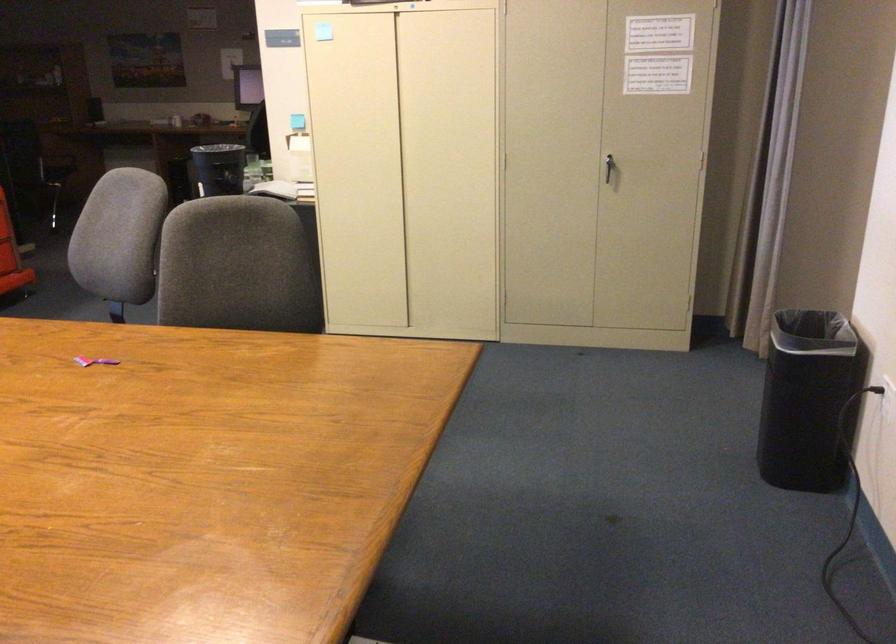
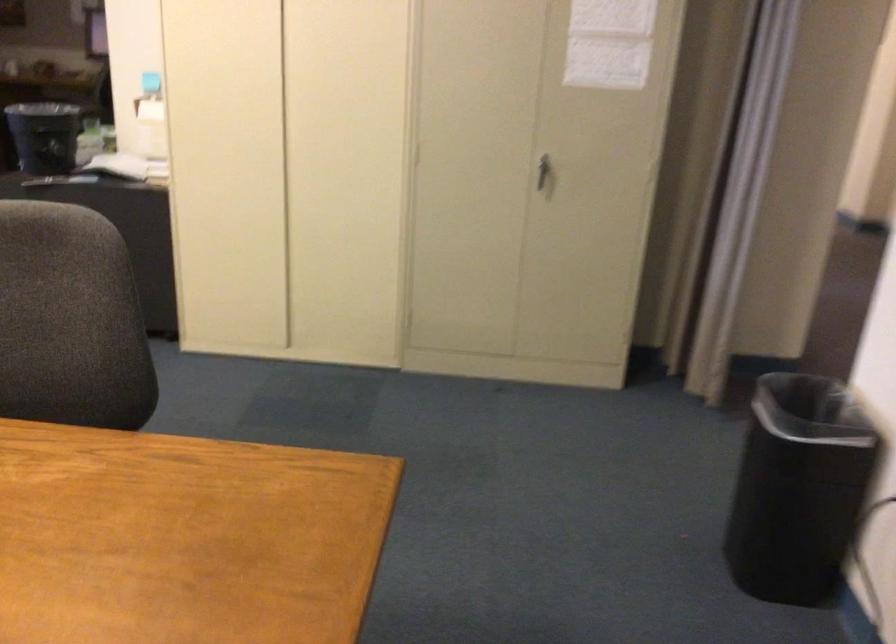
In the second image, find the point that corresponds to point 613,166 in the first image.

(544, 172)